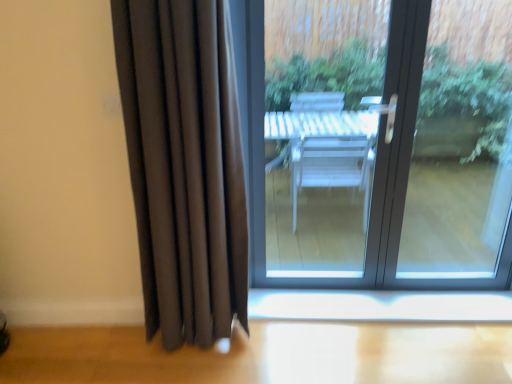
Measure the distance between white glossy window sill at lower center and camera.

The depth of white glossy window sill at lower center is 7.17 feet.

What is the approximate height of matte glass door at center?

4.99 feet.

The width and height of the screenshot is (512, 384). What do you see at coordinates (184, 165) in the screenshot? I see `matte black curtain at left` at bounding box center [184, 165].

This screenshot has width=512, height=384. In order to click on white glossy window sill at lower center in this screenshot , I will do `click(379, 305)`.

Does white glossy window sill at lower center have a larger size compared to matte black curtain at left?

No.

In terms of height, does white glossy window sill at lower center look taller or shorter compared to matte black curtain at left?

Clearly, white glossy window sill at lower center is shorter compared to matte black curtain at left.

Considering the positions of objects white glossy window sill at lower center and matte black curtain at left in the image provided, who is more to the left, white glossy window sill at lower center or matte black curtain at left?

matte black curtain at left.

From the image's perspective, which is above, white glossy window sill at lower center or matte black curtain at left?

From the image's view, matte black curtain at left is above.

Between point (184, 59) and point (335, 313), which one is positioned in front?

The point (184, 59) is in front.

Could you tell me if matte black curtain at left is facing white glossy window sill at lower center?

No, matte black curtain at left is not oriented towards white glossy window sill at lower center.

Which object is closer to the camera, matte black curtain at left or white glossy window sill at lower center?

matte black curtain at left is in front.

Considering the positions of objects matte black curtain at left and white glossy window sill at lower center in the image provided, who is more to the left, matte black curtain at left or white glossy window sill at lower center?

matte black curtain at left.

Is point (161, 35) closer or farther from the camera than point (308, 17)?

Point (161, 35) is closer to the camera than point (308, 17).

Is matte black curtain at left positioned far away from matte glass door at center?

Yes, matte black curtain at left and matte glass door at center are located far from each other.

Which is behind, matte black curtain at left or matte glass door at center?

matte glass door at center.

Based on the photo, does matte black curtain at left have a lesser height compared to matte glass door at center?

Indeed, matte black curtain at left has a lesser height compared to matte glass door at center.

Image resolution: width=512 pixels, height=384 pixels. What are the coordinates of `window sill behind the matte glass door at center` in the screenshot? It's located at (379, 305).

Which is farther from the camera, (476, 5) or (442, 293)?

The point (476, 5) is farther from the camera.

From the picture: Between matte glass door at center and white glossy window sill at lower center, which one has smaller size?

white glossy window sill at lower center.

Does matte glass door at center appear on the right side of matte black curtain at left?

Indeed, matte glass door at center is positioned on the right side of matte black curtain at left.

Which of these two, matte glass door at center or matte black curtain at left, is thinner?

With smaller width is matte black curtain at left.

Who is bigger, matte glass door at center or matte black curtain at left?

matte glass door at center.

In terms of height, does matte glass door at center look taller or shorter compared to matte black curtain at left?

In the image, matte glass door at center appears to be taller than matte black curtain at left.

Does white glossy window sill at lower center appear on the left side of matte glass door at center?

No, white glossy window sill at lower center is not to the left of matte glass door at center.

Which of these two, white glossy window sill at lower center or matte glass door at center, is smaller?

white glossy window sill at lower center.

Is matte glass door at center inside white glossy window sill at lower center?

No.

From a real-world perspective, between white glossy window sill at lower center and matte glass door at center, who is vertically lower?

white glossy window sill at lower center, from a real-world perspective.

Image resolution: width=512 pixels, height=384 pixels. In the image, there is a white glossy window sill at lower center. Identify the location of curtain above it (from the image's perspective). (184, 165).

Where is `window sill that is on the right side of matte black curtain at left`? This screenshot has width=512, height=384. window sill that is on the right side of matte black curtain at left is located at coordinates (379, 305).

Which object lies further to the anchor point matte black curtain at left, white glossy window sill at lower center or matte glass door at center?

matte glass door at center is further to matte black curtain at left.

When comparing their distances from matte glass door at center, does white glossy window sill at lower center or matte black curtain at left seem further?

matte black curtain at left is positioned further to the anchor matte glass door at center.

Looking at the image, which one is located further to matte black curtain at left, matte glass door at center or white glossy window sill at lower center?

matte glass door at center is positioned further to the anchor matte black curtain at left.

When comparing their distances from white glossy window sill at lower center, does matte black curtain at left or matte glass door at center seem further?

Among the two, matte glass door at center is located further to white glossy window sill at lower center.

When comparing their distances from matte glass door at center, does matte black curtain at left or white glossy window sill at lower center seem closer?

white glossy window sill at lower center is positioned closer to the anchor matte glass door at center.

Estimate the real-world distances between objects in this image. Which object is further from white glossy window sill at lower center, matte glass door at center or matte black curtain at left?

matte glass door at center lies further to white glossy window sill at lower center than the other object.

In order to click on door situated between matte black curtain at left and white glossy window sill at lower center from left to right in this screenshot , I will do `click(380, 143)`.